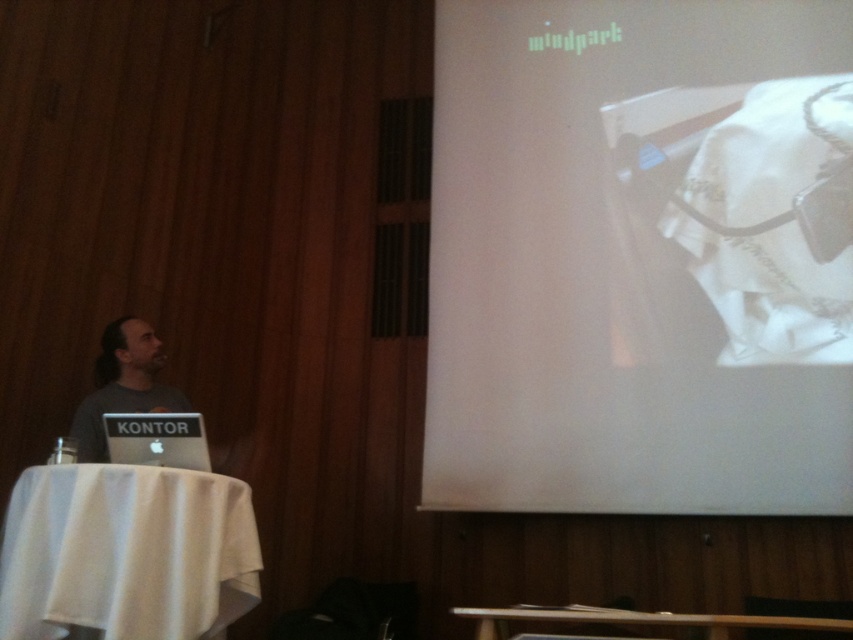
You are an event organizer setting up for a presentation. You need to place a new 24 inch monitor between the white glossy projector screen at upper right and the gray matte laptop at left. Based on their sizes, will the monitor fit between them without overlapping?

The white glossy projector screen at upper right is larger than the gray matte laptop at left. Since the monitor is 24 inches, and the space between them depends on their sizes, but the exact distance isn generated, so it is uncertain if it will fit without overlapping.

You are standing in the conference room and want to move from one point to another. If you start at point (117,378), will you need to walk forward or backward to reach point (148,420)?

Since point (117,378) is closer to the camera than point (148,420), you would need to walk backward to reach point (148,420) from point (117,378).

You are standing in the conference room and need to locate the white glossy projector screen at upper right. According to the coordinates provided, where exactly is it positioned in the image?

The white glossy projector screen at upper right is positioned at the coordinates point (641, 257) in the image.